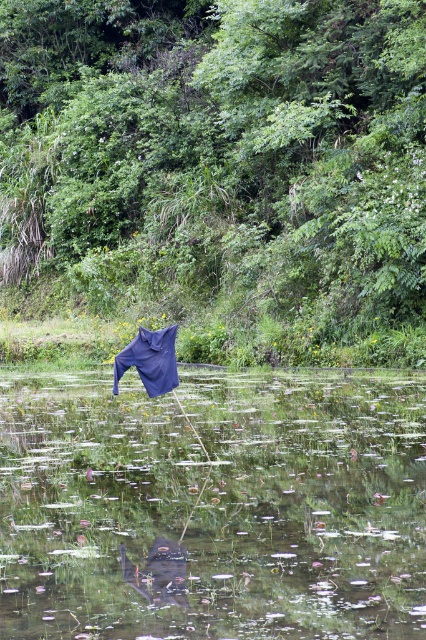
Question: Can you confirm if dark blue fabric at center is bigger than transparent plastic bag at center?

Choices:
 (A) yes
 (B) no

Answer: (A)

Question: Among these points, which one is farthest from the camera?

Choices:
 (A) (141, 372)
 (B) (344, 440)

Answer: (B)

Question: Which point appears farthest from the camera in this image?

Choices:
 (A) (172, 346)
 (B) (52, 609)

Answer: (A)

Question: Is transparent plastic bag at center thinner than blue fabric umbrella at center?

Choices:
 (A) yes
 (B) no

Answer: (B)

Question: Can you confirm if dark blue fabric at center is smaller than transparent plastic bag at center?

Choices:
 (A) no
 (B) yes

Answer: (A)

Question: Which of the following is the farthest from the observer?

Choices:
 (A) (391, 42)
 (B) (161, 392)
 (C) (19, 390)

Answer: (A)